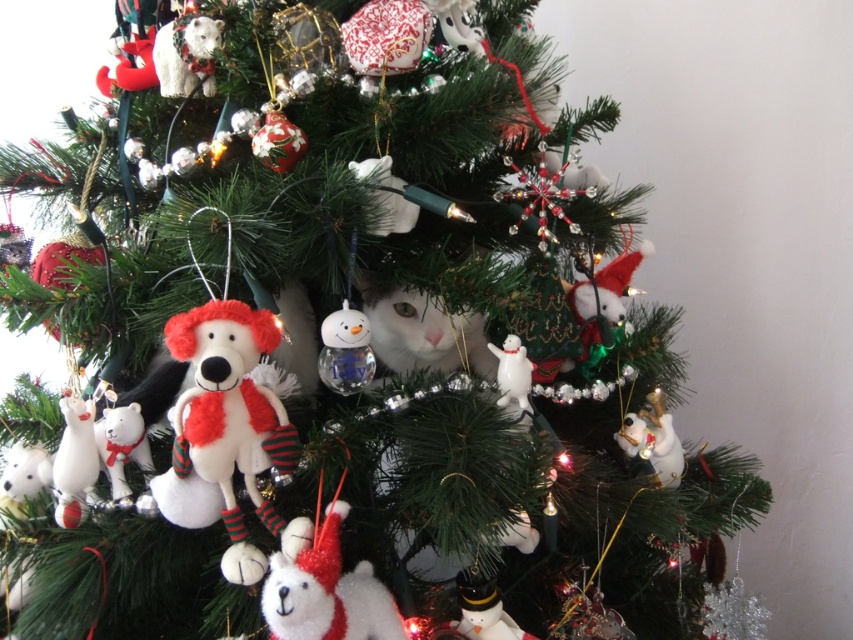
Question: From the image, what is the correct spatial relationship of white plush dog at center in relation to white plush bear at upper left?

Choices:
 (A) right
 (B) left

Answer: (A)

Question: Is transparent glass snowman at center above white plush bear at left?

Choices:
 (A) yes
 (B) no

Answer: (A)

Question: Based on their relative distances, which object is nearer to the white plush bear at upper left?

Choices:
 (A) white glossy dog at lower right
 (B) transparent glass snowman at center
 (C) white plush bear at lower center
 (D) white fluffy cat at center

Answer: (B)

Question: Is white plush dog at center wider than white plush bear at upper left?

Choices:
 (A) yes
 (B) no

Answer: (A)

Question: Which point is farther from the camera taking this photo?

Choices:
 (A) (437, 308)
 (B) (335, 593)
 (C) (190, 310)
 (D) (346, 385)

Answer: (A)

Question: Which point appears farthest from the camera in this image?

Choices:
 (A) (270, 410)
 (B) (671, 445)
 (C) (326, 636)

Answer: (B)